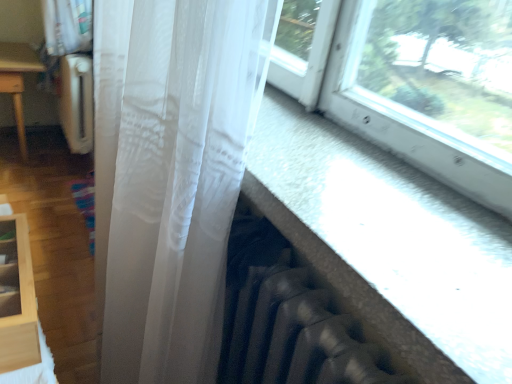
Question: Is translucent white curtain at center bigger than transparent fabric at lower right?

Choices:
 (A) yes
 (B) no

Answer: (A)

Question: Is translucent white curtain at center in contact with transparent fabric at lower right?

Choices:
 (A) yes
 (B) no

Answer: (B)

Question: From the image's perspective, is translucent white curtain at center under transparent fabric at lower right?

Choices:
 (A) yes
 (B) no

Answer: (A)

Question: From a real-world perspective, is translucent white curtain at center located higher than transparent fabric at lower right?

Choices:
 (A) no
 (B) yes

Answer: (A)

Question: Considering the relative sizes of translucent white curtain at center and transparent fabric at lower right in the image provided, is translucent white curtain at center taller than transparent fabric at lower right?

Choices:
 (A) no
 (B) yes

Answer: (B)

Question: Is translucent white curtain at center taller or shorter than transparent fabric at lower right?

Choices:
 (A) tall
 (B) short

Answer: (A)

Question: From the image's perspective, is translucent white curtain at center above or below transparent fabric at lower right?

Choices:
 (A) below
 (B) above

Answer: (A)

Question: In terms of size, does translucent white curtain at center appear bigger or smaller than transparent fabric at lower right?

Choices:
 (A) small
 (B) big

Answer: (B)

Question: Do you think translucent white curtain at center is within transparent fabric at lower right, or outside of it?

Choices:
 (A) outside
 (B) inside

Answer: (A)

Question: From a real-world perspective, relative to translucent white curtain at center, is transparent fabric at lower right vertically above or below?

Choices:
 (A) above
 (B) below

Answer: (A)

Question: From the image's perspective, is transparent fabric at lower right positioned above or below translucent white curtain at center?

Choices:
 (A) above
 (B) below

Answer: (A)

Question: Do you think transparent fabric at lower right is within translucent white curtain at center, or outside of it?

Choices:
 (A) outside
 (B) inside

Answer: (A)

Question: From their relative heights in the image, would you say transparent fabric at lower right is taller or shorter than translucent white curtain at center?

Choices:
 (A) short
 (B) tall

Answer: (A)

Question: From a real-world perspective, relative to light wood shelf at lower left, is translucent white curtain at center vertically above or below?

Choices:
 (A) above
 (B) below

Answer: (B)

Question: Is translucent white curtain at center taller or shorter than light wood shelf at lower left?

Choices:
 (A) short
 (B) tall

Answer: (B)